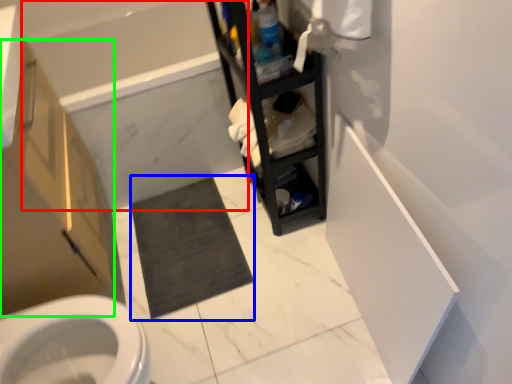
Question: Estimate the real-world distances between objects in this image. Which object is closer to bath (highlighted by a red box), bath mat (highlighted by a blue box) or bathroom cabinet (highlighted by a green box)?

Choices:
 (A) bath mat
 (B) bathroom cabinet

Answer: (A)